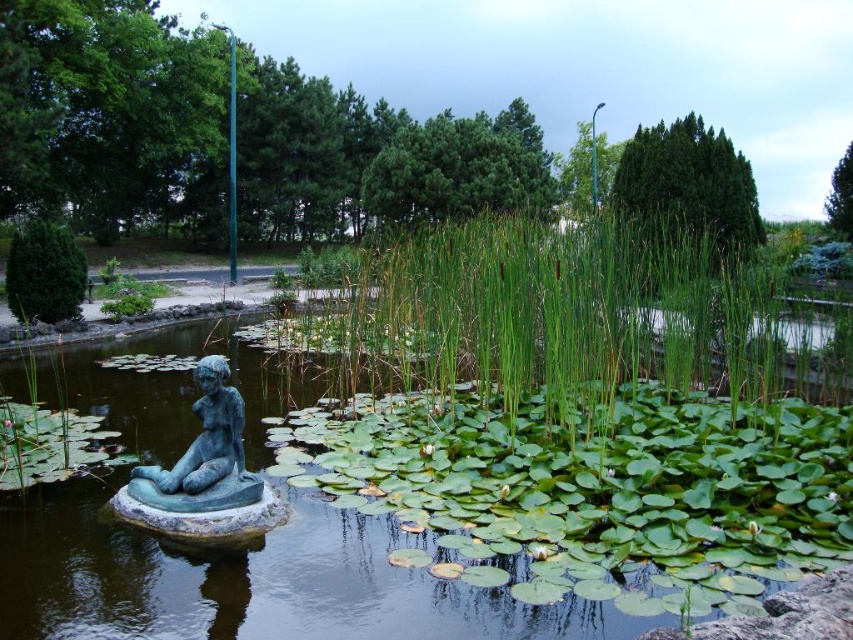
Question: Is green grassy reed at center above green patina statue at lower left?

Choices:
 (A) yes
 (B) no

Answer: (A)

Question: Which of these objects is positioned farthest from the green grassy reed at center?

Choices:
 (A) green patina statue at lower left
 (B) green patina statue at left

Answer: (A)

Question: Which of the following is the farthest from the observer?

Choices:
 (A) green patina statue at left
 (B) green patina statue at lower left

Answer: (B)

Question: From the image, what is the correct spatial relationship of green grassy reed at center in relation to green patina statue at lower left?

Choices:
 (A) right
 (B) left

Answer: (A)

Question: Which of the following is the farthest from the observer?

Choices:
 (A) (263, 358)
 (B) (612, 246)

Answer: (A)

Question: Can you confirm if green patina statue at left is positioned to the left of green grassy reed at center?

Choices:
 (A) no
 (B) yes

Answer: (B)